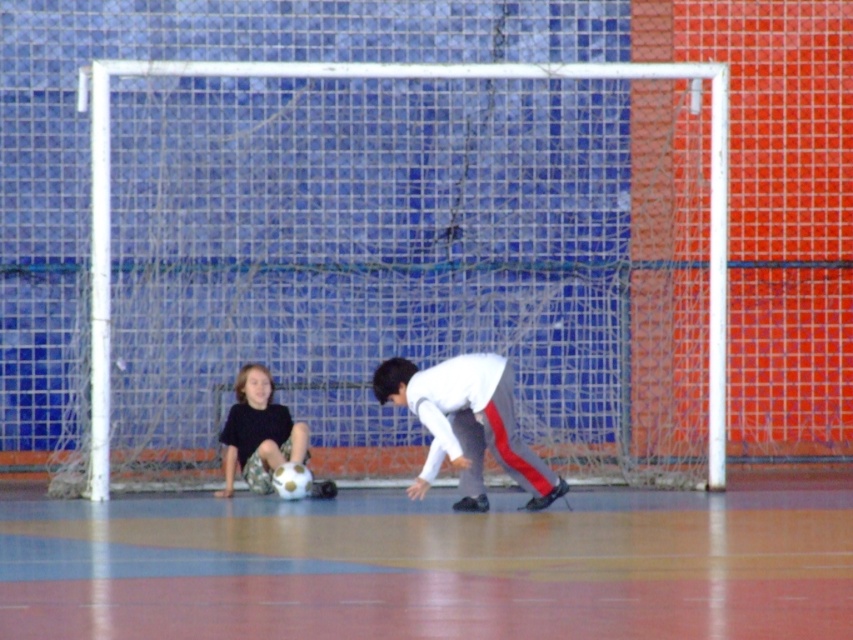
Find the location of a particular element. The height and width of the screenshot is (640, 853). brown wooden floor at center is located at coordinates [x=433, y=566].

Between brown wooden floor at center and white matte shirt at center, which one is positioned higher?

white matte shirt at center

This screenshot has width=853, height=640. Describe the element at coordinates (433, 566) in the screenshot. I see `brown wooden floor at center` at that location.

In order to click on brown wooden floor at center in this screenshot , I will do `click(433, 566)`.

Is white mesh netting at center to the right of white matte shirt at center from the viewer's perspective?

Correct, you'll find white mesh netting at center to the right of white matte shirt at center.

Is white mesh netting at center shorter than white matte shirt at center?

Incorrect, white mesh netting at center's height does not fall short of white matte shirt at center's.

Is point (727, 228) positioned in front of point (466, 476)?

No, (727, 228) is behind (466, 476).

What are the coordinates of `white mesh netting at center` in the screenshot? It's located at pyautogui.click(x=392, y=77).

Is brown wooden floor at center above white mesh netting at center?

No.

Who is positioned more to the right, brown wooden floor at center or white mesh netting at center?

Positioned to the right is white mesh netting at center.

The height and width of the screenshot is (640, 853). What do you see at coordinates (433, 566) in the screenshot?
I see `brown wooden floor at center` at bounding box center [433, 566].

Identify the location of brown wooden floor at center. This screenshot has height=640, width=853. (433, 566).